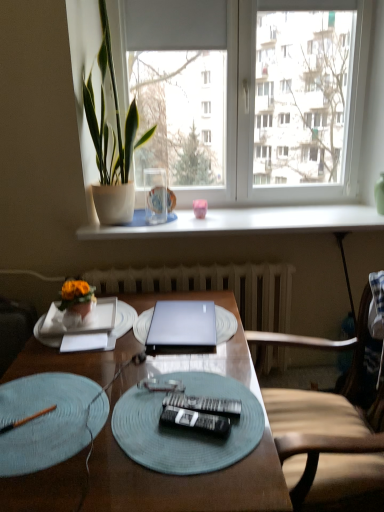
Image resolution: width=384 pixels, height=512 pixels. Identify the location of free location to the right of pink matte coffee cup at center. (234, 217).